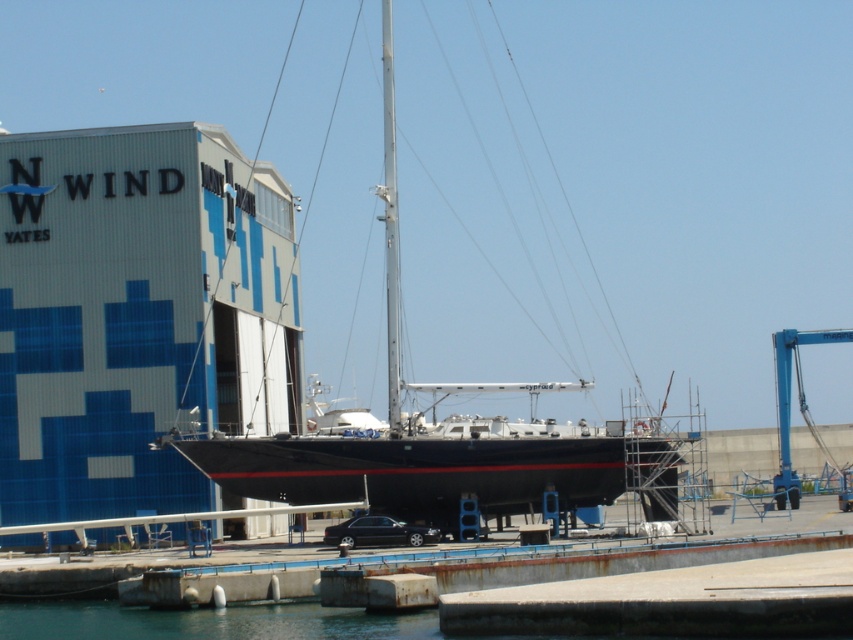
You are a dock worker who needs to secure the black glossy sailboat at center and the silver metallic mast at center to the dock. Which object should you secure first if you start from the left side of the dock?

The silver metallic mast at center should be secured first because it is positioned to the left of the black glossy sailboat at center, so starting from the left side of the dock, you would reach the silver metallic mast at center first.

You are standing at the dockyard looking at the sailboat. The silver metallic mast at center is represented by point (390, 225). Where is the silver metallic mast at center located in relation to the modern blue and white building to the left?

The silver metallic mast at center is located to the right of the modern blue and white building to the left because the point (390, 225) indicates its position relative to the building.

Where is the silver metallic mast at center located in the image?

The silver metallic mast at center is located at point (x=390, y=225) in the image.